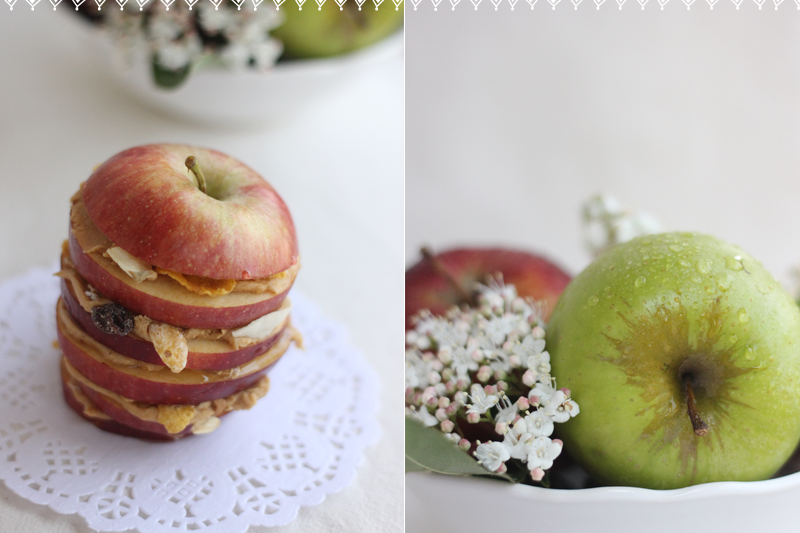
Identify the location of table cloth. The width and height of the screenshot is (800, 533). (369, 491), (37, 122), (346, 172).